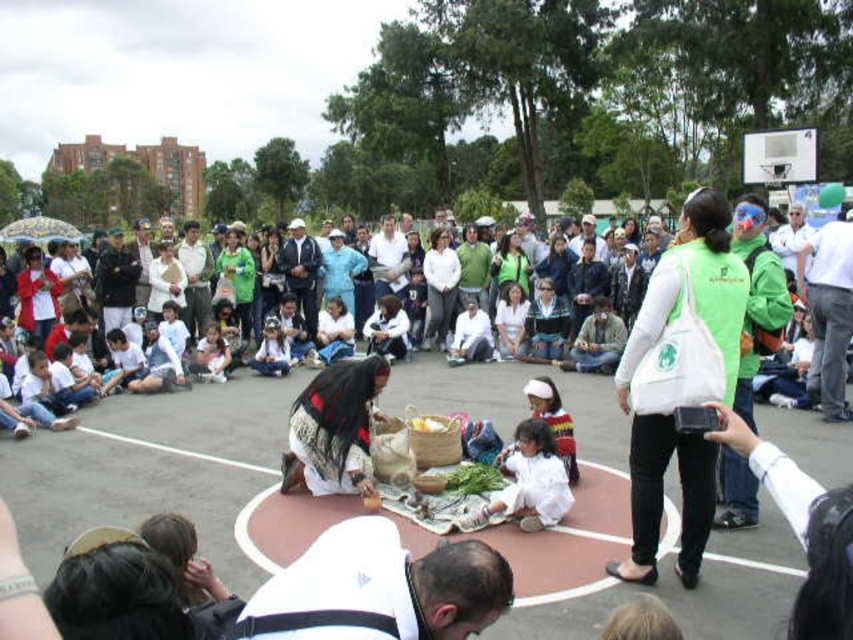
Is white fabric blanket at center smaller than patterned fabric dress at center?

No.

Who is positioned more to the right, white fabric blanket at center or patterned fabric dress at center?

white fabric blanket at center

Which is in front, point (534, 570) or point (357, 376)?

Positioned in front is point (534, 570).

Where is `white fabric blanket at center`? white fabric blanket at center is located at coordinates (570, 541).

The image size is (853, 640). I want to click on white fabric shirt at lower center, so click(379, 588).

Can you confirm if white fabric shirt at lower center is thinner than green fabric bag at center?

Incorrect, white fabric shirt at lower center's width is not less than green fabric bag at center's.

Which is behind, point (454, 573) or point (627, 573)?

The point (627, 573) is more distant.

Image resolution: width=853 pixels, height=640 pixels. I want to click on white fabric shirt at lower center, so [379, 588].

Can you confirm if white woven blanket at center is taller than white fabric blanket at center?

Correct, white woven blanket at center is much taller as white fabric blanket at center.

Which is below, white woven blanket at center or white fabric blanket at center?

white fabric blanket at center is lower down.

Where is `white woven blanket at center`? white woven blanket at center is located at coordinates (151, 467).